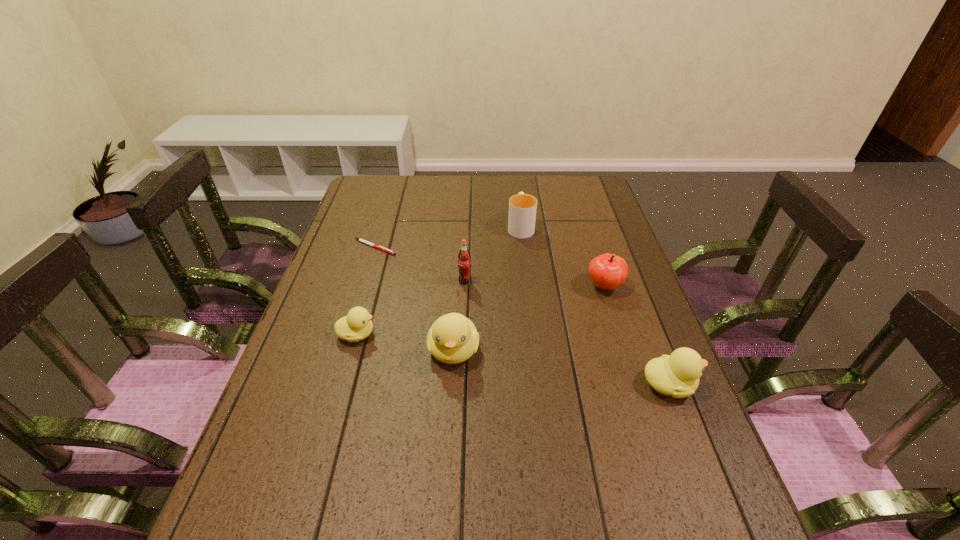
Identify the location of duckling located in the right edge section of the desktop. (677, 375).

Find the location of a particular element. apple that is at the right edge is located at coordinates (608, 271).

Identify the location of vacant point at the far edge. (417, 193).

The image size is (960, 540). I want to click on vacant space at the left edge, so click(372, 215).

The image size is (960, 540). What are the coordinates of `vacant space at the right edge` in the screenshot? It's located at (571, 221).

In order to click on blank space at the far left corner of the desktop in this screenshot , I will do `click(358, 193)`.

Identify the location of free location at the far right corner of the desktop. (571, 186).

Locate an element on the screen. Image resolution: width=960 pixels, height=540 pixels. vacant region between the second shortest object and the apple is located at coordinates (481, 310).

Where is `free space between the second duckling from right to left and the second shortest duckling`? The image size is (960, 540). free space between the second duckling from right to left and the second shortest duckling is located at coordinates (562, 367).

Identify the location of empty location between the farthest object and the shortest object. The image size is (960, 540). (447, 237).